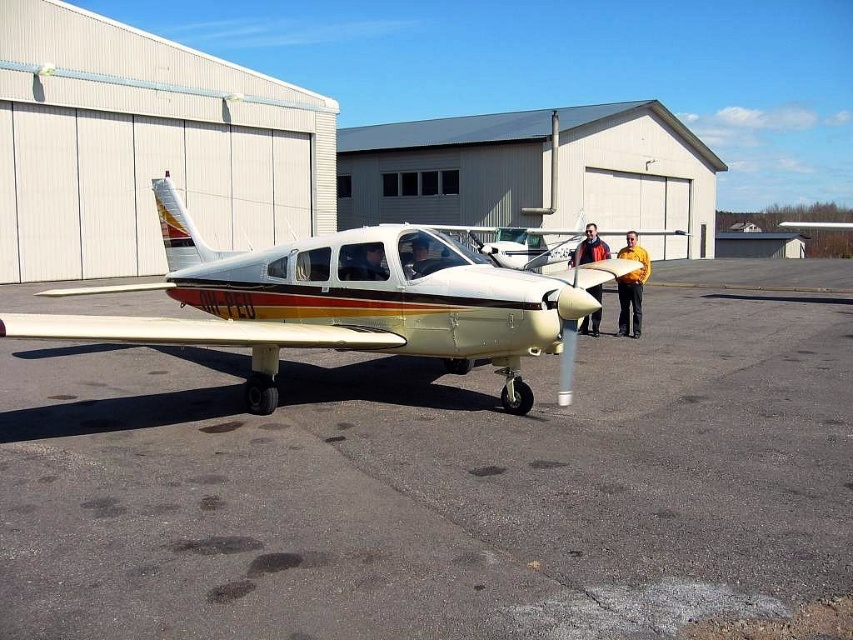
Question: Based on their relative distances, which object is nearer to the metallic gold airplane at center?

Choices:
 (A) matte black helmet at center
 (B) smooth asphalt tarmac at center
 (C) yellow shirt at center

Answer: (B)

Question: Which object is farther from the camera taking this photo?

Choices:
 (A) gold metallic airplane at center
 (B) smooth asphalt tarmac at center

Answer: (A)

Question: Does yellow shirt at center have a lesser width compared to matte black helmet at center?

Choices:
 (A) no
 (B) yes

Answer: (A)

Question: Is smooth asphalt tarmac at center below metallic gold airplane at center?

Choices:
 (A) no
 (B) yes

Answer: (B)

Question: Is gold metallic airplane at center smaller than orange fabric jacket at center?

Choices:
 (A) no
 (B) yes

Answer: (A)

Question: Which point is farther to the camera?

Choices:
 (A) (601, 248)
 (B) (514, 253)
 (C) (619, 256)
 (D) (376, 243)

Answer: (A)